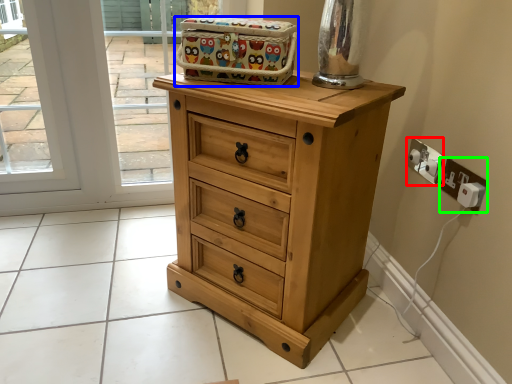
Question: Which is farther away from electric outlet (highlighted by a red box)? crate (highlighted by a blue box) or electric outlet (highlighted by a green box)?

Choices:
 (A) crate
 (B) electric outlet

Answer: (A)